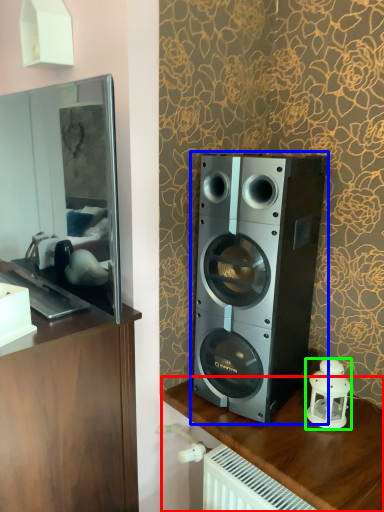
Question: Considering the real-world distances, which object is closest to furniture (highlighted by a red box)? home appliance (highlighted by a blue box) or candle holder (highlighted by a green box).

Choices:
 (A) home appliance
 (B) candle holder

Answer: (B)